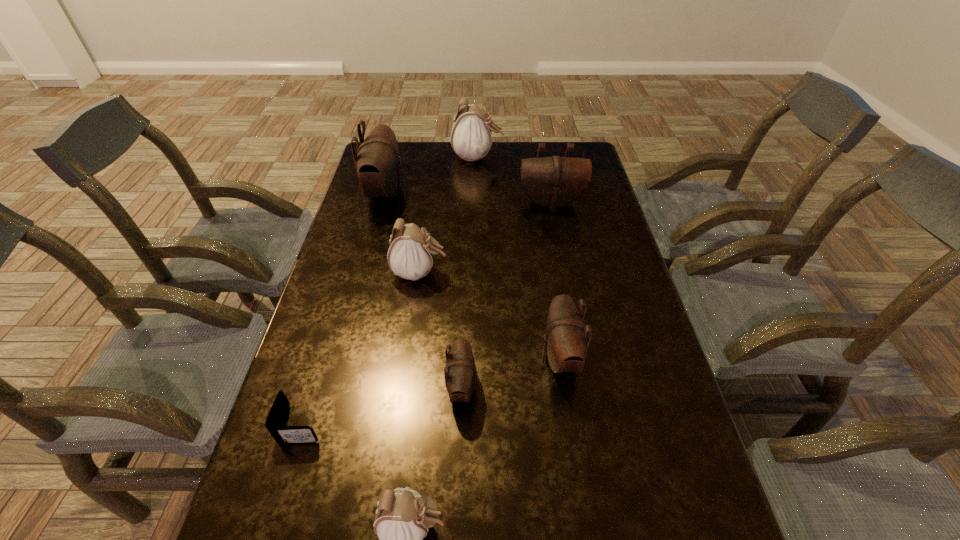
At what (x,y) coordinates should I click in order to perform the action: click on vacant area between the fourth nearest pouch and the third smallest brown pouch. Please return your answer as a coordinate pair (x, y). The height and width of the screenshot is (540, 960). Looking at the image, I should click on (486, 238).

Locate an element on the screen. This screenshot has height=540, width=960. vacant area between the second biggest brown pouch and the shortest object is located at coordinates (427, 313).

Where is `vacant point located between the shortest object and the farthest object`? The height and width of the screenshot is (540, 960). vacant point located between the shortest object and the farthest object is located at coordinates (390, 291).

Locate an element on the screen. This screenshot has height=540, width=960. free spot between the smallest brown pouch and the second smallest white pouch is located at coordinates (441, 330).

Locate which object is the sixth closest to the wallet. Please provide its 2D coordinates. Your answer should be formatted as a tuple, i.e. [(x, y)], where the tuple contains the x and y coordinates of a point satisfying the conditions above.

[(552, 182)]

At what (x,y) coordinates should I click in order to perform the action: click on object that is the second closest to the fourth farthest object. Please return your answer as a coordinate pair (x, y). The image size is (960, 540). Looking at the image, I should click on (460, 373).

Point out which pouch is positioned as the fifth nearest to the smallest brown pouch. Please provide its 2D coordinates. Your answer should be formatted as a tuple, i.e. [(x, y)], where the tuple contains the x and y coordinates of a point satisfying the conditions above.

[(552, 182)]

Where is `the closest pouch relative to the farthest object`? The height and width of the screenshot is (540, 960). the closest pouch relative to the farthest object is located at coordinates (377, 161).

Select which brown pouch is the third closest to the second smallest white pouch. Please provide its 2D coordinates. Your answer should be formatted as a tuple, i.e. [(x, y)], where the tuple contains the x and y coordinates of a point satisfying the conditions above.

[(566, 341)]

Where is `brown pouch that can be found as the closest to the biggest brown pouch`? The width and height of the screenshot is (960, 540). brown pouch that can be found as the closest to the biggest brown pouch is located at coordinates (552, 182).